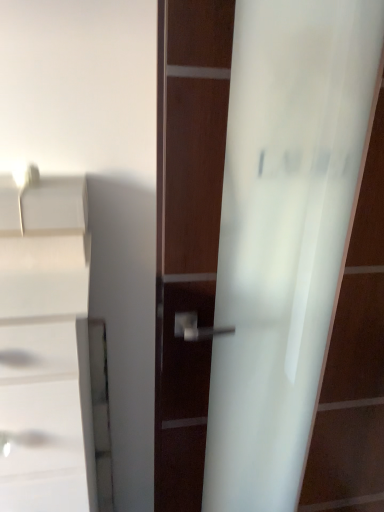
Measure the distance between point (268, 52) and camera.

The depth of point (268, 52) is 31.30 inches.

Locate an element on the screen. The image size is (384, 512). frosted glass door handle at center is located at coordinates (283, 234).

Measure the distance between frosted glass door handle at center and camera.

They are 29.61 inches apart.

What do you see at coordinates (283, 234) in the screenshot? The height and width of the screenshot is (512, 384). I see `frosted glass door handle at center` at bounding box center [283, 234].

What do you see at coordinates (46, 337) in the screenshot? I see `white glossy cabinet at left` at bounding box center [46, 337].

What is the approximate height of white glossy cabinet at left?

3.40 feet.

In order to face white glossy cabinet at left, should I rotate leftwards or rightwards?

You should look left and rotate roughly 21.204 degrees.

What is the approximate width of white glossy cabinet at left?

white glossy cabinet at left is 18.46 inches wide.

The image size is (384, 512). In order to click on white glossy cabinet at left in this screenshot , I will do `click(46, 337)`.

The height and width of the screenshot is (512, 384). In order to click on frosted glass door handle at center in this screenshot , I will do `click(283, 234)`.

Is white glossy cabinet at left to the right of frosted glass door handle at center from the viewer's perspective?

In fact, white glossy cabinet at left is to the left of frosted glass door handle at center.

Which object is more forward, white glossy cabinet at left or frosted glass door handle at center?

white glossy cabinet at left is in front.

Between point (46, 280) and point (309, 185), which one is positioned behind?

Positioned behind is point (309, 185).

From the image's perspective, which is above, white glossy cabinet at left or frosted glass door handle at center?

frosted glass door handle at center is shown above in the image.

From a real-world perspective, is white glossy cabinet at left located beneath frosted glass door handle at center?

Yes.

Is white glossy cabinet at left wider than frosted glass door handle at center?

Correct, the width of white glossy cabinet at left exceeds that of frosted glass door handle at center.

Based on the photo, can you confirm if white glossy cabinet at left is taller than frosted glass door handle at center?

In fact, white glossy cabinet at left may be shorter than frosted glass door handle at center.

Considering the sizes of objects white glossy cabinet at left and frosted glass door handle at center in the image provided, who is smaller, white glossy cabinet at left or frosted glass door handle at center?

white glossy cabinet at left.

Is white glossy cabinet at left not within frosted glass door handle at center?

Yes, white glossy cabinet at left is not within frosted glass door handle at center.

Is white glossy cabinet at left beside frosted glass door handle at center?

No, white glossy cabinet at left is not next to frosted glass door handle at center.

Is white glossy cabinet at left oriented away from frosted glass door handle at center?

No.

Measure the distance between white glossy cabinet at left and frosted glass door handle at center.

A distance of 16.77 inches exists between white glossy cabinet at left and frosted glass door handle at center.

The width and height of the screenshot is (384, 512). I want to click on screen door that is on the right side of white glossy cabinet at left, so click(283, 234).

Does frosted glass door handle at center appear on the left side of white glossy cabinet at left?

No, frosted glass door handle at center is not to the left of white glossy cabinet at left.

Is the position of frosted glass door handle at center more distant than that of white glossy cabinet at left?

Yes, frosted glass door handle at center is further from the viewer.

Between point (218, 478) and point (79, 443), which one is positioned in front?

Positioned in front is point (79, 443).

From the image's perspective, is frosted glass door handle at center under white glossy cabinet at left?

No, from the image's perspective, frosted glass door handle at center is not below white glossy cabinet at left.

From a real-world perspective, who is located lower, frosted glass door handle at center or white glossy cabinet at left?

In real-world perspective, white glossy cabinet at left is lower.

Consider the image. Considering the relative sizes of frosted glass door handle at center and white glossy cabinet at left in the image provided, is frosted glass door handle at center thinner than white glossy cabinet at left?

Yes.

Is frosted glass door handle at center taller than white glossy cabinet at left?

Yes.

Considering the sizes of objects frosted glass door handle at center and white glossy cabinet at left in the image provided, who is bigger, frosted glass door handle at center or white glossy cabinet at left?

Bigger between the two is frosted glass door handle at center.

Is frosted glass door handle at center spatially inside white glossy cabinet at left, or outside of it?

frosted glass door handle at center is outside white glossy cabinet at left.

Are frosted glass door handle at center and white glossy cabinet at left located far from each other?

No, there isn't a large distance between frosted glass door handle at center and white glossy cabinet at left.

Does frosted glass door handle at center turn towards white glossy cabinet at left?

No, frosted glass door handle at center is not aimed at white glossy cabinet at left.

Can you tell me how much frosted glass door handle at center and white glossy cabinet at left differ in facing direction?

The angle between the facing direction of frosted glass door handle at center and the facing direction of white glossy cabinet at left is 1.63 degrees.

Locate an element on the screen. screen door to the right of white glossy cabinet at left is located at coordinates (283, 234).

Locate an element on the screen. screen door above the white glossy cabinet at left (from a real-world perspective) is located at coordinates (283, 234).

Find the location of a particular element. The width and height of the screenshot is (384, 512). cabinetry that is in front of the frosted glass door handle at center is located at coordinates (46, 337).